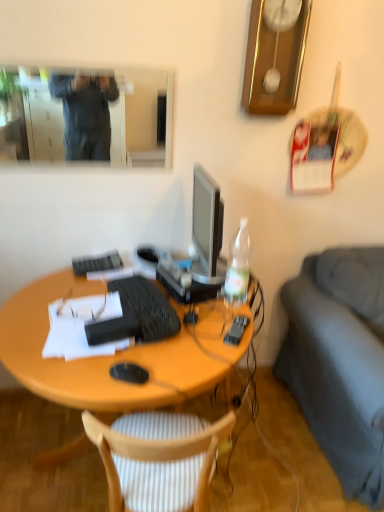
Where is `vacant area that lies between black matte keyboard at center, the first computer keyboard in the top-to-bottom sequence, and matte black glasses at center`? The height and width of the screenshot is (512, 384). vacant area that lies between black matte keyboard at center, the first computer keyboard in the top-to-bottom sequence, and matte black glasses at center is located at coordinates (87, 286).